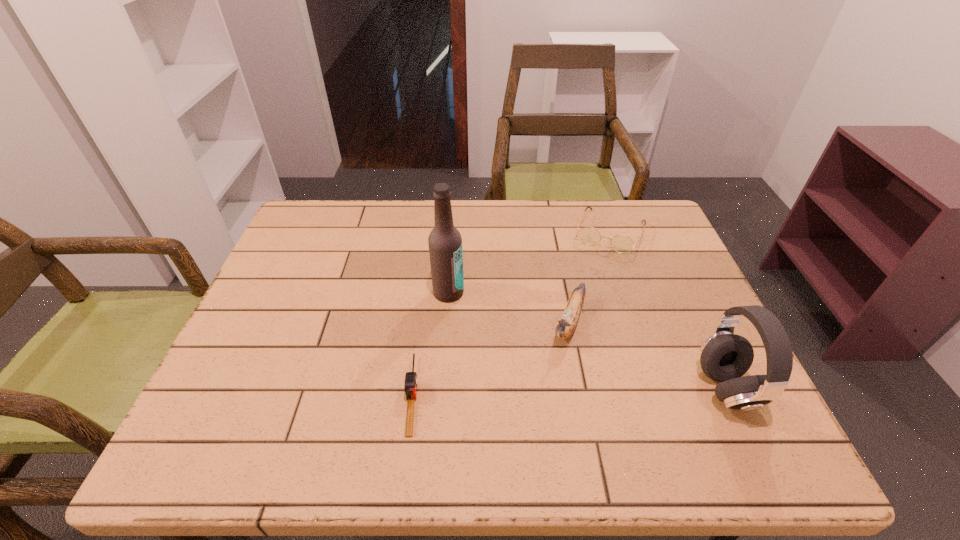
Where is `the shortest object`? Image resolution: width=960 pixels, height=540 pixels. the shortest object is located at coordinates (410, 386).

Find the location of `tape measure`. tape measure is located at coordinates (410, 386).

At what (x,y) coordinates should I click in order to perform the action: click on the fourth shortest object. Please return your answer as a coordinate pair (x, y). Looking at the image, I should click on (724, 357).

Identify the location of beer bottle. This screenshot has width=960, height=540. (445, 243).

Find the location of a particular element. The width and height of the screenshot is (960, 540). the tallest object is located at coordinates (445, 243).

Identify the location of spectacles. (589, 235).

You are a GUI agent. You are given a task and a screenshot of the screen. Output one action in this format:
    pyautogui.click(x=<x>, y=<y>)
    Task: Click on the second shortest object
    This screenshot has height=540, width=960.
    Given the screenshot: What is the action you would take?
    pyautogui.click(x=589, y=235)

Locate an element on the screen. This screenshot has width=960, height=540. the third object from right to left is located at coordinates [x=566, y=326].

Where is `the third shortest object`? the third shortest object is located at coordinates (566, 326).

Where is `vacant space situated 0.360m on the right of the shortest object`? Image resolution: width=960 pixels, height=540 pixels. vacant space situated 0.360m on the right of the shortest object is located at coordinates (590, 395).